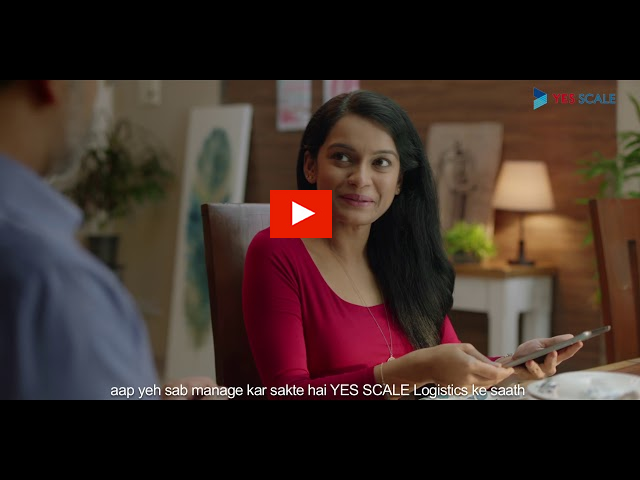
Where is `lampshade`? This screenshot has height=480, width=640. lampshade is located at coordinates (524, 187).